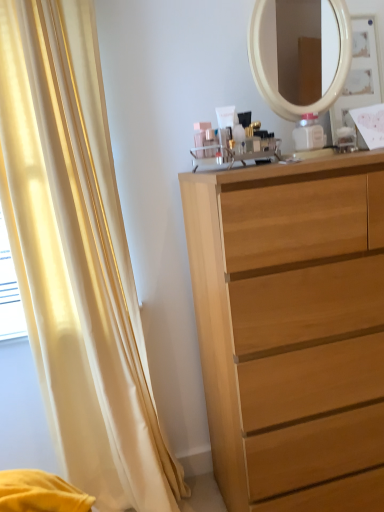
Describe the element at coordinates (77, 258) in the screenshot. I see `silky yellow curtain at left` at that location.

Find the location of a particular element. silky yellow curtain at left is located at coordinates (77, 258).

Measure the distance between silky yellow curtain at left and camera.

A distance of 1.14 meters exists between silky yellow curtain at left and camera.

The height and width of the screenshot is (512, 384). What are the coordinates of `light wood chest of drawers at center` in the screenshot? It's located at (292, 329).

What do you see at coordinates (292, 329) in the screenshot? This screenshot has height=512, width=384. I see `light wood chest of drawers at center` at bounding box center [292, 329].

Measure the distance between point (366,228) and camera.

The distance of point (366,228) from camera is 1.14 meters.

Find the location of `silky yellow curtain at left`. silky yellow curtain at left is located at coordinates (77, 258).

Based on their positions, is silky yellow curtain at left located to the left or right of light wood chest of drawers at center?

In the image, silky yellow curtain at left appears on the left side of light wood chest of drawers at center.

Which is in front, silky yellow curtain at left or light wood chest of drawers at center?

light wood chest of drawers at center is more forward.

Does point (141, 507) lie in front of point (287, 474)?

No, (141, 507) is further to viewer.

From the image's perspective, which object appears higher, silky yellow curtain at left or light wood chest of drawers at center?

From the image's view, silky yellow curtain at left is above.

From a real-world perspective, is silky yellow curtain at left positioned over light wood chest of drawers at center based on gravity?

Yes, from a real-world perspective, silky yellow curtain at left is on top of light wood chest of drawers at center.

Which of these two, silky yellow curtain at left or light wood chest of drawers at center, is thinner?

silky yellow curtain at left.

Is silky yellow curtain at left taller or shorter than light wood chest of drawers at center?

Clearly, silky yellow curtain at left is taller compared to light wood chest of drawers at center.

Considering the relative sizes of silky yellow curtain at left and light wood chest of drawers at center in the image provided, is silky yellow curtain at left smaller than light wood chest of drawers at center?

Yes.

Do you think silky yellow curtain at left is within light wood chest of drawers at center, or outside of it?

silky yellow curtain at left lies outside light wood chest of drawers at center.

Is there a large distance between silky yellow curtain at left and light wood chest of drawers at center?

No, silky yellow curtain at left is not far away from light wood chest of drawers at center.

From the picture: Is silky yellow curtain at left oriented towards light wood chest of drawers at center?

No, silky yellow curtain at left is not turned towards light wood chest of drawers at center.

Find the location of a particular element. curtain on the left of light wood chest of drawers at center is located at coordinates (77, 258).

Looking at this image, is light wood chest of drawers at center at the left side of silky yellow curtain at left?

No.

Does light wood chest of drawers at center lie in front of silky yellow curtain at left?

Yes.

Is point (236, 362) closer or farther from the camera than point (68, 404)?

Point (236, 362) appears to be closer to the viewer than point (68, 404).

From the image's perspective, is light wood chest of drawers at center below silky yellow curtain at left?

Yes.

From a real-world perspective, does light wood chest of drawers at center sit lower than silky yellow curtain at left?

Indeed, from a real-world perspective, light wood chest of drawers at center is positioned beneath silky yellow curtain at left.

Does light wood chest of drawers at center have a lesser width compared to silky yellow curtain at left?

No, light wood chest of drawers at center is not thinner than silky yellow curtain at left.

Considering the sizes of objects light wood chest of drawers at center and silky yellow curtain at left in the image provided, who is shorter, light wood chest of drawers at center or silky yellow curtain at left?

light wood chest of drawers at center.

Can you confirm if light wood chest of drawers at center is smaller than silky yellow curtain at left?

Incorrect, light wood chest of drawers at center is not smaller in size than silky yellow curtain at left.

Can we say light wood chest of drawers at center lies outside silky yellow curtain at left?

Yes.

Would you consider light wood chest of drawers at center to be distant from silky yellow curtain at left?

They are positioned close to each other.

Could you tell me if light wood chest of drawers at center is facing silky yellow curtain at left?

No, light wood chest of drawers at center does not turn towards silky yellow curtain at left.

How different are the orientations of light wood chest of drawers at center and silky yellow curtain at left in degrees?

There is a 0.00087-degree angle between the facing directions of light wood chest of drawers at center and silky yellow curtain at left.

Locate an element on the screen. The height and width of the screenshot is (512, 384). curtain behind the light wood chest of drawers at center is located at coordinates (77, 258).

Where is `curtain on the left of the light wood chest of drawers at center`? Image resolution: width=384 pixels, height=512 pixels. curtain on the left of the light wood chest of drawers at center is located at coordinates (77, 258).

Identify the location of curtain lying above the light wood chest of drawers at center (from the image's perspective). This screenshot has width=384, height=512. (77, 258).